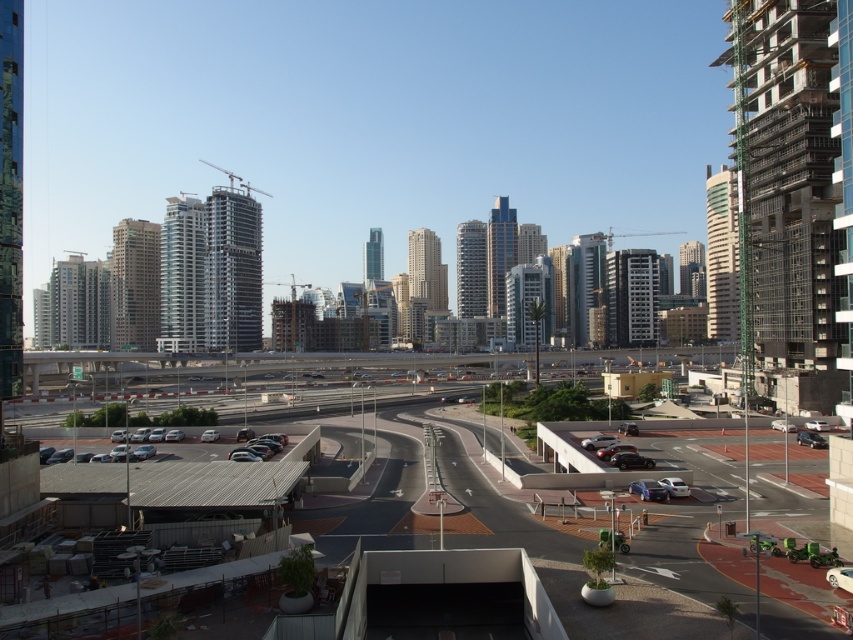
Can you confirm if asphalt road at center is taller than satin silver sedan at center?

Yes.

Which is above, asphalt road at center or satin silver sedan at center?

satin silver sedan at center is above.

Describe the element at coordinates (207, 496) in the screenshot. The height and width of the screenshot is (640, 853). I see `asphalt road at center` at that location.

At what (x,y) coordinates should I click in order to perform the action: click on asphalt road at center. Please return your answer as a coordinate pair (x, y). Image resolution: width=853 pixels, height=640 pixels. Looking at the image, I should click on (207, 496).

Is white glossy sedan at lower right closer to the viewer compared to satin silver sedan at center?

Yes.

Is point (679, 496) positioned after point (607, 438)?

That is False.

Find the location of a particular element. The height and width of the screenshot is (640, 853). white glossy sedan at lower right is located at coordinates (674, 486).

Locate an element on the screen. The width and height of the screenshot is (853, 640). white glossy sedan at lower right is located at coordinates pyautogui.click(x=674, y=486).

Between shiny blue sedan at center and shiny metallic car at center, which one is positioned higher?

Positioned higher is shiny metallic car at center.

Can you confirm if shiny blue sedan at center is positioned above shiny metallic car at center?

Actually, shiny blue sedan at center is below shiny metallic car at center.

Is point (628, 488) more distant than point (641, 458)?

That is False.

This screenshot has width=853, height=640. Find the location of `shiny blue sedan at center`. shiny blue sedan at center is located at coordinates (648, 490).